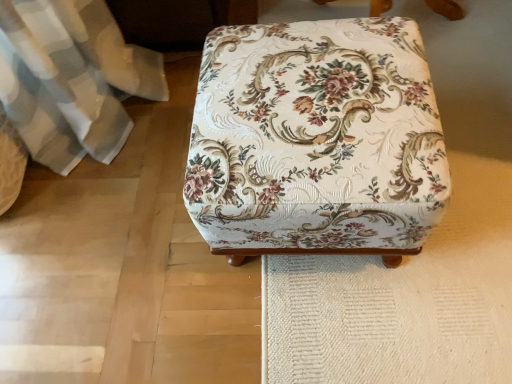
The width and height of the screenshot is (512, 384). What are the coordinates of `floral fabric ottoman at center` in the screenshot? It's located at (316, 140).

The width and height of the screenshot is (512, 384). Describe the element at coordinates (316, 140) in the screenshot. I see `floral fabric ottoman at center` at that location.

What is the approximate height of floral fabric ottoman at center?

floral fabric ottoman at center is 14.15 inches in height.

Where is `floral fabric ottoman at center`? The height and width of the screenshot is (384, 512). floral fabric ottoman at center is located at coordinates (316, 140).